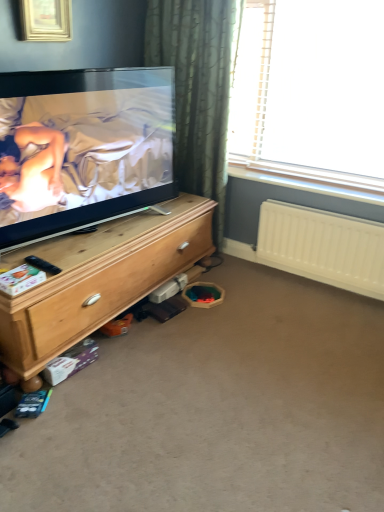
This screenshot has width=384, height=512. What are the coordinates of `free region under matte black tv at left (from a real-world perspective)` in the screenshot? It's located at (99, 231).